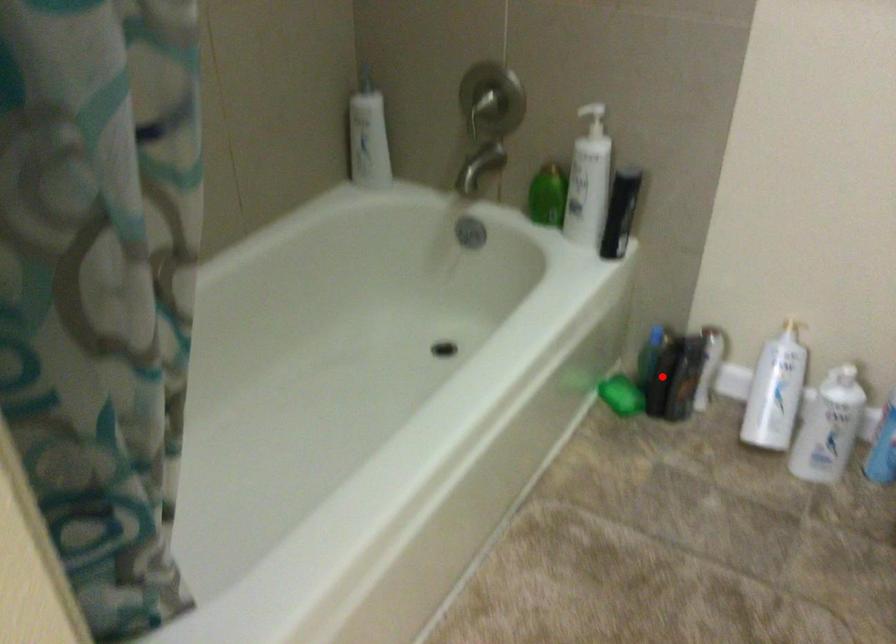
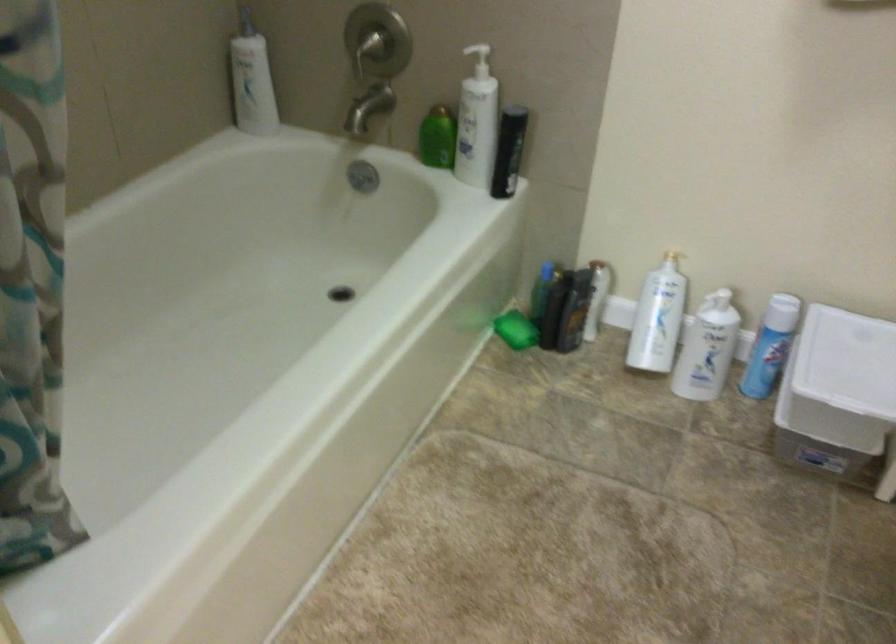
Locate, in the second image, the point that corresponds to the highlighted location in the first image.

(554, 308)